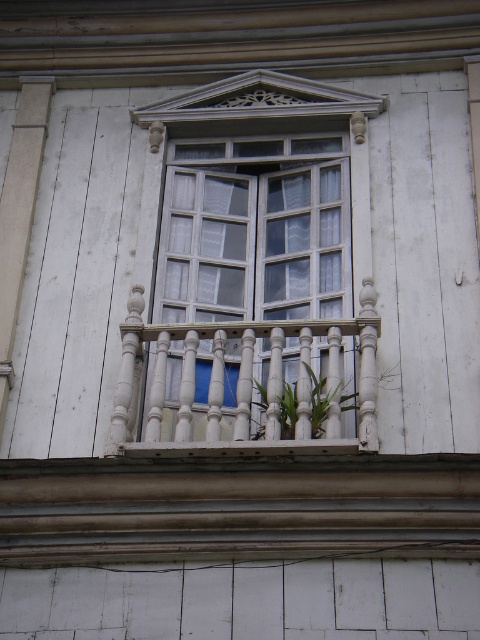
Question: Which point appears farthest from the camera in this image?

Choices:
 (A) (259, 353)
 (B) (297, 394)

Answer: (A)

Question: Does clear glass window at center have a smaller size compared to green leafy plant at center?

Choices:
 (A) yes
 (B) no

Answer: (B)

Question: Which object appears farthest from the camera in this image?

Choices:
 (A) green leafy plant at center
 (B) clear glass window at center
 (C) white wooden balcony at center

Answer: (B)

Question: Can you confirm if white wooden balcony at center is wider than green leafy plant at center?

Choices:
 (A) yes
 (B) no

Answer: (A)

Question: Which point is closer to the camera?

Choices:
 (A) green leafy plant at center
 (B) clear glass window at center
 (C) white wooden balcony at center

Answer: (C)

Question: Can you confirm if white wooden balcony at center is positioned to the right of green leafy plant at center?

Choices:
 (A) yes
 (B) no

Answer: (B)